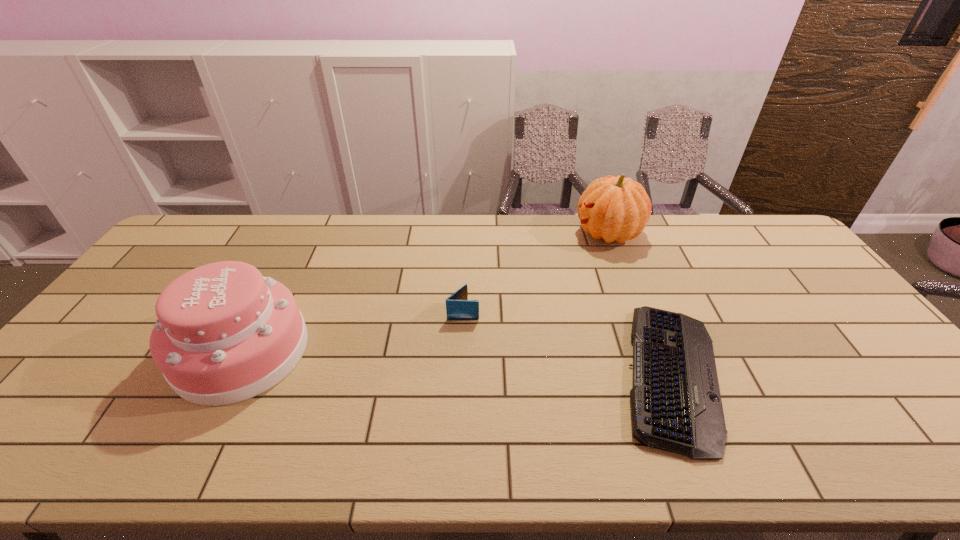
Identify the location of pumpkin. (617, 209).

Where is `the leftmost object`? The width and height of the screenshot is (960, 540). the leftmost object is located at coordinates (224, 334).

At what (x,y) coordinates should I click in order to perform the action: click on the third object from right to left. Please return your answer as a coordinate pair (x, y). Looking at the image, I should click on (458, 307).

This screenshot has width=960, height=540. I want to click on the second shortest object, so (458, 307).

Identify the location of the shortest object. The height and width of the screenshot is (540, 960). (676, 406).

Find the location of a particular element. The image size is (960, 540). free space located on the carved face of the pumpkin is located at coordinates (556, 233).

What are the coordinates of `vacant area situated 0.070m on the carved face of the pumpkin` in the screenshot? It's located at [556, 233].

What are the coordinates of `free space located on the carved face of the pumpkin` in the screenshot? It's located at (547, 233).

You are a GUI agent. You are given a task and a screenshot of the screen. Output one action in this format:
    pyautogui.click(x=<x>, y=<y>)
    Task: Click on the free space located on the right of the birthday cake
    The height and width of the screenshot is (540, 960).
    Given the screenshot: What is the action you would take?
    pyautogui.click(x=393, y=351)

Locate an element on the screen. This screenshot has width=960, height=540. vacant space positioned 0.340m on the exterior surface of the wallet is located at coordinates (596, 311).